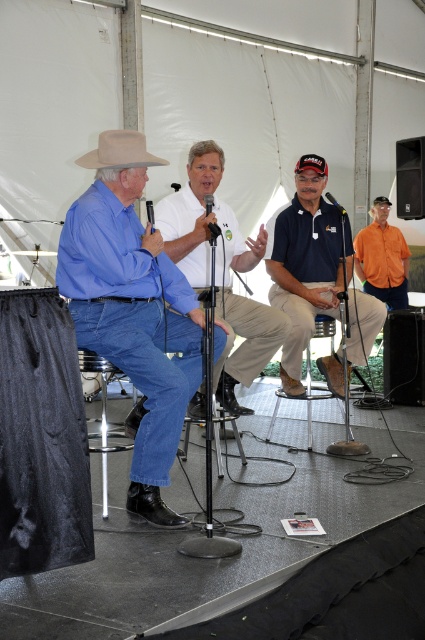
Where is `navy blue shirt at center`? The image size is (425, 640). navy blue shirt at center is located at coordinates (303, 262).

The height and width of the screenshot is (640, 425). Describe the element at coordinates (303, 262) in the screenshot. I see `navy blue shirt at center` at that location.

Where is `navy blue shirt at center`? The width and height of the screenshot is (425, 640). navy blue shirt at center is located at coordinates (303, 262).

Can you confirm if navy blue shirt at center is wider than black matte speaker at upper right?

Yes.

Which is in front, point (280, 228) or point (405, 176)?

Point (280, 228) is in front.

Image resolution: width=425 pixels, height=640 pixels. I want to click on navy blue shirt at center, so click(x=303, y=262).

Who is taller, matte blue shirt at left or black matte speaker at upper right?

matte blue shirt at left is taller.

Who is more forward, [190,310] or [413,177]?

Positioned in front is point [190,310].

Does point (146, 248) lie in front of point (399, 186)?

Yes, point (146, 248) is in front of point (399, 186).

Locate an element on the screen. This screenshot has width=425, height=640. matte blue shirt at left is located at coordinates (133, 308).